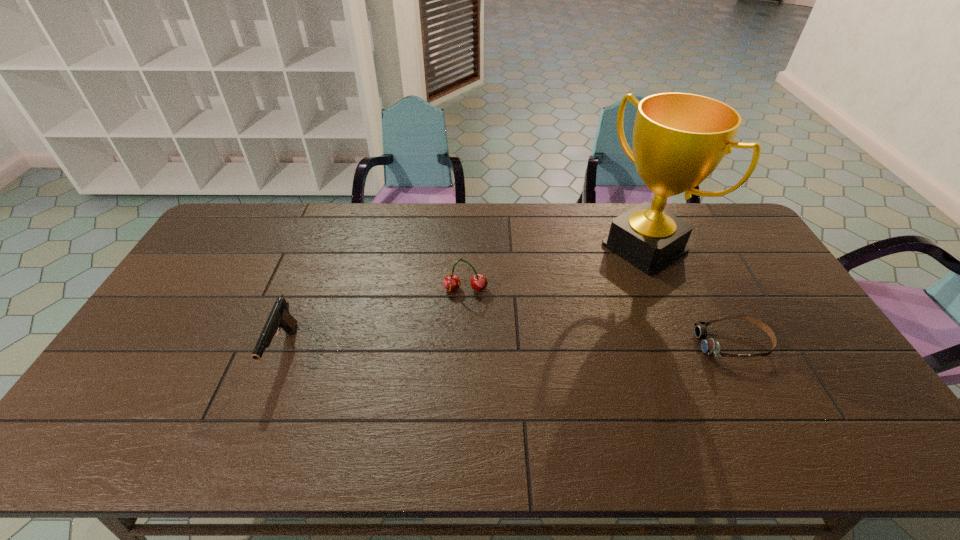
Locate an element on the screen. Image resolution: width=960 pixels, height=540 pixels. vacant space on the desktop that is between the leftmost object and the goggles and is positioned with stems pointing upwards on the second object from left to right is located at coordinates (463, 348).

Where is `vacant space on the desktop that is between the leftmost object and the shortest object and is positioned on the front-facing side of the award`? This screenshot has width=960, height=540. vacant space on the desktop that is between the leftmost object and the shortest object and is positioned on the front-facing side of the award is located at coordinates (483, 348).